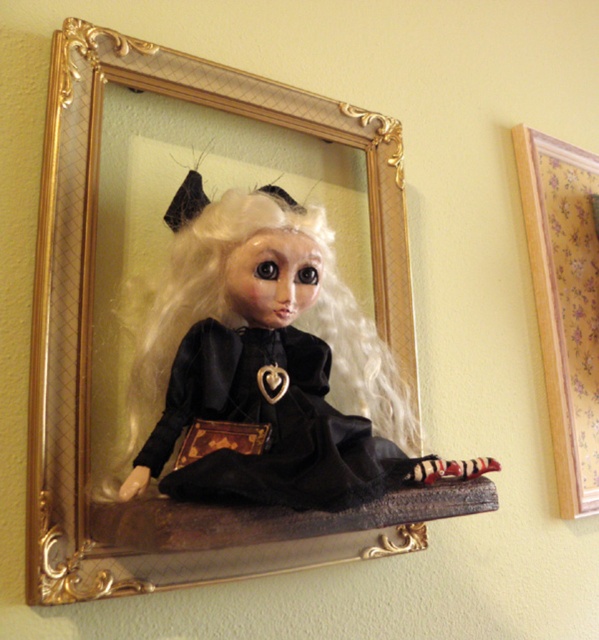
You are an interior designer planning to hang a new painting next to the goldwoodenpicture frame at center and the white silky hair at center. Which object should you consider the size of to ensure proper spacing?

The goldwoodenpicture frame at center is larger in width than the white silky hair at center, so you should consider the size of the goldwoodenpicture frame at center to ensure proper spacing.

You are an interior designer looking at the framed doll on the wall. You need to know the spatial relationship between the goldwoodenpicture frame at center and the white silky hair at center. Which object is positioned to the right?

The goldwoodenpicture frame at center is to the right of white silky hair at center.

You are an interior designer arranging a wall display. You have a goldwoodenpicture frame at center and a wooden at upper right. Based on their sizes, which object should you place higher to ensure visual balance?

The goldwoodenpicture frame at center is larger in size than the wooden at upper right, so to achieve visual balance, the smaller wooden at upper right should be placed higher on the wall.